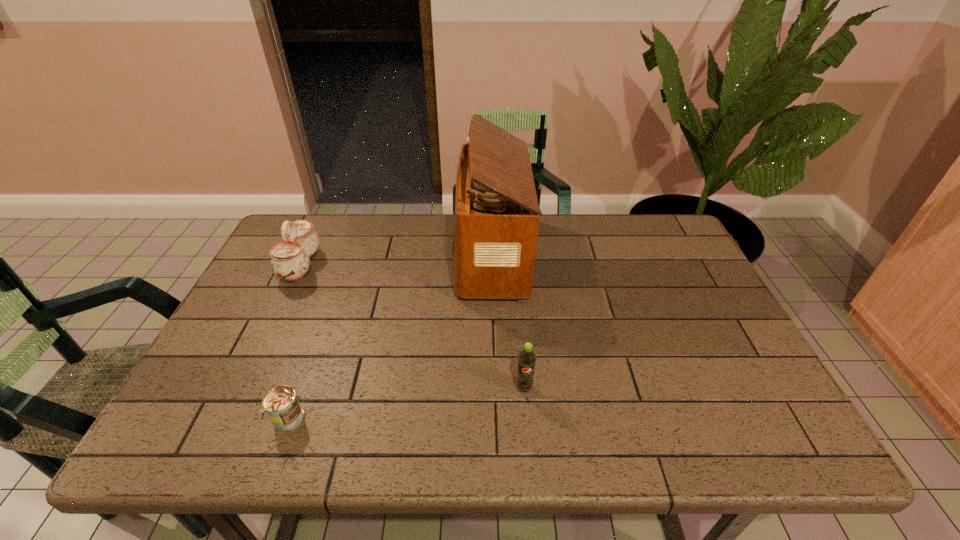
The image size is (960, 540). In order to click on radio receiver in this screenshot , I will do `click(496, 213)`.

Where is `the leftmost object`? Image resolution: width=960 pixels, height=540 pixels. the leftmost object is located at coordinates (290, 261).

This screenshot has height=540, width=960. I want to click on the third farthest object, so click(527, 358).

Where is `the third object from right to left`? The width and height of the screenshot is (960, 540). the third object from right to left is located at coordinates (281, 403).

You are a GUI agent. You are given a task and a screenshot of the screen. Output one action in this format:
    pyautogui.click(x=<x>, y=<y>)
    Task: Click on the can
    This screenshot has width=960, height=540.
    Given the screenshot: What is the action you would take?
    pyautogui.click(x=281, y=403)

Locate an element on the screen. This screenshot has width=960, height=540. free space located on the front panel of the tallest object is located at coordinates (x=391, y=255).

You are a GUI agent. You are given a task and a screenshot of the screen. Output one action in this format:
    pyautogui.click(x=<x>, y=<y>)
    Task: Click on the vacant space situated on the front panel of the tallest object
    
    Given the screenshot: What is the action you would take?
    pyautogui.click(x=391, y=255)

This screenshot has height=540, width=960. Identify the location of vacant area situated on the front panel of the tallest object. (334, 255).

At what (x,y) coordinates should I click in order to perform the action: click on free space located by the handle of the leftmost object. Please return your answer as a coordinate pair (x, y). Image resolution: width=960 pixels, height=540 pixels. Looking at the image, I should click on (369, 266).

Locate an element on the screen. The width and height of the screenshot is (960, 540). vacant point located 0.210m on the back of the nearest object is located at coordinates (321, 329).